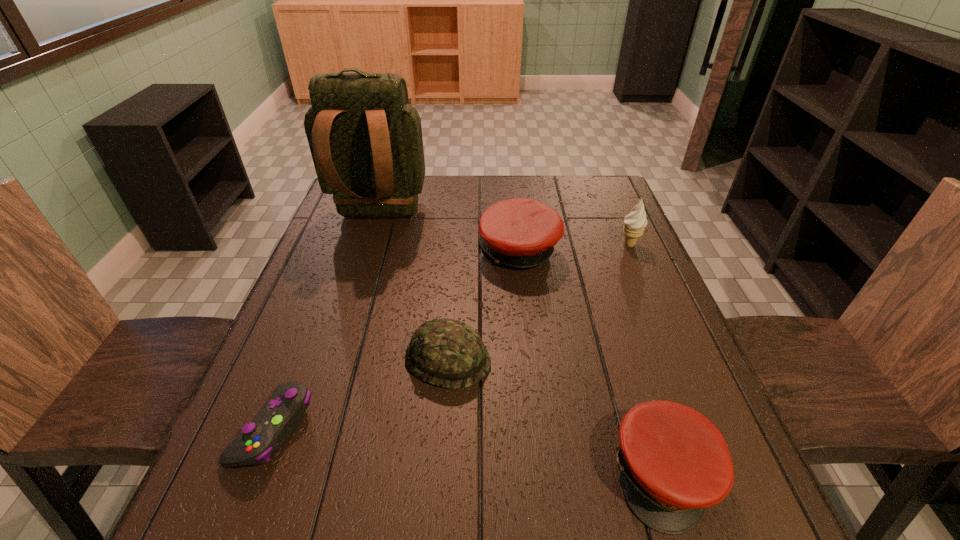
Image resolution: width=960 pixels, height=540 pixels. What are the coordinates of `cap that is at the right edge` in the screenshot? It's located at (674, 462).

At what (x,y) coordinates should I click in order to perform the action: click on object present at the far left corner. Please return your answer as a coordinate pair (x, y). Looking at the image, I should click on (365, 139).

The image size is (960, 540). What are the coordinates of `object at the near right corner` in the screenshot? It's located at (674, 462).

Identify the location of vacant space at the far edge of the desktop. (526, 185).

In the image, there is a desktop. Find the location of `vacant space at the left edge`. vacant space at the left edge is located at coordinates (366, 263).

Identify the location of vacant space at the right edge of the desktop. This screenshot has width=960, height=540. (676, 402).

Where is `free space at the near left corner of the desktop`? This screenshot has height=540, width=960. free space at the near left corner of the desktop is located at coordinates (225, 510).

This screenshot has width=960, height=540. I want to click on vacant region at the far right corner of the desktop, so click(600, 199).

At what (x,y) coordinates should I click in order to perform the action: click on free space at the near right corner of the desktop. Please return your answer as a coordinate pair (x, y). Looking at the image, I should click on (749, 491).

Where is `free point between the second farthest cap and the farthest cap`? free point between the second farthest cap and the farthest cap is located at coordinates (484, 305).